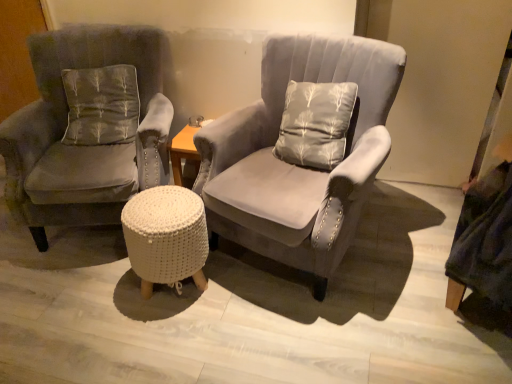
How much space does suede gray armchair at center, which appears as the second chair when viewed from the left, occupy vertically?

35.39 inches.

The width and height of the screenshot is (512, 384). In order to click on white knitted stool at center in this screenshot , I will do `click(166, 237)`.

I want to click on suede gray armchair at center, the first chair viewed from the right, so click(x=297, y=166).

Is white knitted stool at center oriented away from gray fabric pillow at left?

No, gray fabric pillow at left is not at the back of white knitted stool at center.

Is the depth of white knitted stool at center less than that of gray fabric pillow at left?

Yes, it is in front of gray fabric pillow at left.

Which point is more forward, (196, 266) or (127, 142)?

Point (196, 266)

Which object is positioned more to the left, white knitted stool at center or gray fabric pillow at left?

From the viewer's perspective, gray fabric pillow at left appears more on the left side.

Which of these two, suede gray armchair at center, which appears as the second chair when viewed from the left, or white knitted stool at center, is bigger?

Bigger between the two is suede gray armchair at center, which appears as the second chair when viewed from the left.

Is suede gray armchair at center, the first chair viewed from the right, to the left or to the right of white knitted stool at center in the image?

Clearly, suede gray armchair at center, the first chair viewed from the right, is on the right of white knitted stool at center in the image.

Is suede gray armchair at center, the first chair viewed from the right, with white knitted stool at center?

suede gray armchair at center, the first chair viewed from the right, and white knitted stool at center are not in contact.

Which is closer to the camera, (x=294, y=80) or (x=181, y=277)?

Point (x=294, y=80) is farther from the camera than point (x=181, y=277).

From a real-world perspective, is velvet gray armchair at left, which appears as the first chair when viewed from the left, positioned under gray fabric pillow at left based on gravity?

Correct, in the physical world, velvet gray armchair at left, which appears as the first chair when viewed from the left, is lower than gray fabric pillow at left.

How distant is velvet gray armchair at left, the 2th chair viewed from the right, from gray fabric pillow at left?

velvet gray armchair at left, the 2th chair viewed from the right, and gray fabric pillow at left are 4.18 inches apart from each other.

Who is more distant, velvet gray armchair at left, the 2th chair viewed from the right, or gray fabric pillow at left?

gray fabric pillow at left.

Does velvet gray armchair at left, which appears as the first chair when viewed from the left, have a larger size compared to gray fabric pillow at left?

Yes.

Would you consider suede gray armchair at center, which appears as the second chair when viewed from the left, to be distant from velvet gray armchair at left, the 2th chair viewed from the right?

suede gray armchair at center, which appears as the second chair when viewed from the left, is near velvet gray armchair at left, the 2th chair viewed from the right, not far away.

In terms of height, does suede gray armchair at center, the first chair viewed from the right, look taller or shorter compared to velvet gray armchair at left, the 2th chair viewed from the right?

Considering their sizes, suede gray armchair at center, the first chair viewed from the right, has more height than velvet gray armchair at left, the 2th chair viewed from the right.

From the picture: Is suede gray armchair at center, the first chair viewed from the right, wider or thinner than velvet gray armchair at left, the 2th chair viewed from the right?

Clearly, suede gray armchair at center, the first chair viewed from the right, has less width compared to velvet gray armchair at left, the 2th chair viewed from the right.

In terms of size, does suede gray armchair at center, which appears as the second chair when viewed from the left, appear bigger or smaller than velvet gray armchair at left, the 2th chair viewed from the right?

Clearly, suede gray armchair at center, which appears as the second chair when viewed from the left, is smaller in size than velvet gray armchair at left, the 2th chair viewed from the right.

Based on the photo, based on their positions, is white knitted stool at center located to the left or right of suede gray armchair at center, which appears as the second chair when viewed from the left?

white knitted stool at center is positioned on suede gray armchair at center, which appears as the second chair when viewed from the left,'s left side.

In the scene shown: From the image's perspective, is white knitted stool at center below suede gray armchair at center, which appears as the second chair when viewed from the left?

Yes.

Is suede gray armchair at center, which appears as the second chair when viewed from the left, at the back of white knitted stool at center?

Yes, white knitted stool at center is facing away from suede gray armchair at center, which appears as the second chair when viewed from the left.

Considering the sizes of white knitted stool at center and suede gray armchair at center, the first chair viewed from the right, in the image, is white knitted stool at center wider or thinner than suede gray armchair at center, the first chair viewed from the right,?

white knitted stool at center is thinner than suede gray armchair at center, the first chair viewed from the right.

This screenshot has width=512, height=384. In order to click on chair that is on the left side of suede gray armchair at center, which appears as the second chair when viewed from the left in this screenshot , I will do `click(88, 127)`.

Between velvet gray armchair at left, the 2th chair viewed from the right, and suede gray armchair at center, the first chair viewed from the right, which one has smaller size?

suede gray armchair at center, the first chair viewed from the right, is smaller.

Can you confirm if velvet gray armchair at left, which appears as the first chair when viewed from the left, is thinner than suede gray armchair at center, the first chair viewed from the right?

Incorrect, the width of velvet gray armchair at left, which appears as the first chair when viewed from the left, is not less than that of suede gray armchair at center, the first chair viewed from the right.

Which of these two, velvet gray armchair at left, the 2th chair viewed from the right, or suede gray armchair at center, the first chair viewed from the right, stands shorter?

With less height is velvet gray armchair at left, the 2th chair viewed from the right.

Can you tell me how much gray fabric pillow at left and suede gray armchair at center, which appears as the second chair when viewed from the left, differ in facing direction?

There is a 37-degree angle between the facing directions of gray fabric pillow at left and suede gray armchair at center, which appears as the second chair when viewed from the left.

Would you say gray fabric pillow at left is outside suede gray armchair at center, which appears as the second chair when viewed from the left?

gray fabric pillow at left is positioned outside suede gray armchair at center, which appears as the second chair when viewed from the left.

Does point (135, 78) come farther from viewer compared to point (378, 70)?

That is True.

The width and height of the screenshot is (512, 384). In the image, there is a white knitted stool at center. What are the coordinates of `pillow above it (from the image's perspective)` in the screenshot? It's located at (101, 105).

Find the location of a particular element. the 1st chair positioned above the white knitted stool at center (from a real-world perspective) is located at coordinates (297, 166).

When comparing their distances from suede gray armchair at center, the first chair viewed from the right, does gray fabric pillow at left or white knitted stool at center seem further?

The object further to suede gray armchair at center, the first chair viewed from the right, is gray fabric pillow at left.

In the scene shown: Considering their positions, is gray fabric pillow at left positioned closer to suede gray armchair at center, which appears as the second chair when viewed from the left, than velvet gray armchair at left, which appears as the first chair when viewed from the left?

velvet gray armchair at left, which appears as the first chair when viewed from the left, is positioned closer to the anchor suede gray armchair at center, which appears as the second chair when viewed from the left.

Based on their spatial positions, is white knitted stool at center or suede gray armchair at center, which appears as the second chair when viewed from the left, closer to velvet gray armchair at left, which appears as the first chair when viewed from the left?

white knitted stool at center lies closer to velvet gray armchair at left, which appears as the first chair when viewed from the left, than the other object.

When comparing their distances from gray fabric pillow at left, does suede gray armchair at center, the first chair viewed from the right, or velvet gray armchair at left, which appears as the first chair when viewed from the left, seem further?

The object further to gray fabric pillow at left is suede gray armchair at center, the first chair viewed from the right.

Looking at the image, which one is located further to white knitted stool at center, velvet gray armchair at left, which appears as the first chair when viewed from the left, or gray fabric pillow at left?

Among the two, gray fabric pillow at left is located further to white knitted stool at center.

From the image, which object appears to be nearer to velvet gray armchair at left, which appears as the first chair when viewed from the left, suede gray armchair at center, the first chair viewed from the right, or white knitted stool at center?

Based on the image, white knitted stool at center appears to be nearer to velvet gray armchair at left, which appears as the first chair when viewed from the left.

Considering their positions, is gray fabric pillow at left positioned closer to velvet gray armchair at left, the 2th chair viewed from the right, than suede gray armchair at center, which appears as the second chair when viewed from the left?

gray fabric pillow at left is positioned closer to the anchor velvet gray armchair at left, the 2th chair viewed from the right.

Based on their spatial positions, is gray fabric pillow at left or white knitted stool at center closer to velvet gray armchair at left, which appears as the first chair when viewed from the left?

gray fabric pillow at left is closer to velvet gray armchair at left, which appears as the first chair when viewed from the left.

Where is `pillow situated between velvet gray armchair at left, the 2th chair viewed from the right, and suede gray armchair at center, the first chair viewed from the right, from left to right`? The height and width of the screenshot is (384, 512). pillow situated between velvet gray armchair at left, the 2th chair viewed from the right, and suede gray armchair at center, the first chair viewed from the right, from left to right is located at coordinates (101, 105).

Where is `music stool between gray fabric pillow at left and suede gray armchair at center, which appears as the second chair when viewed from the left, from left to right`? The width and height of the screenshot is (512, 384). music stool between gray fabric pillow at left and suede gray armchair at center, which appears as the second chair when viewed from the left, from left to right is located at coordinates (166, 237).

This screenshot has width=512, height=384. What are the coordinates of `music stool between velvet gray armchair at left, which appears as the first chair when viewed from the left, and suede gray armchair at center, which appears as the second chair when viewed from the left` in the screenshot? It's located at (166, 237).